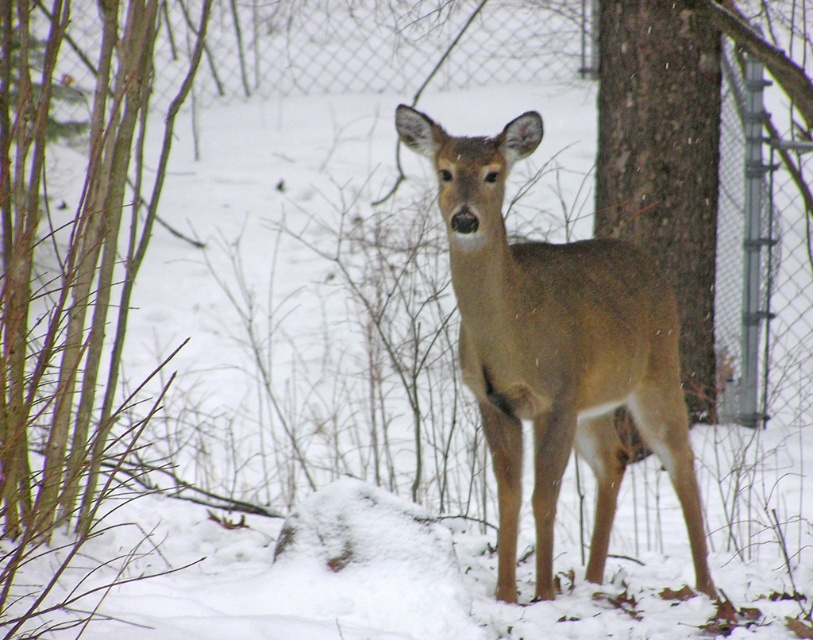
Question: Is brown matte/deer at center to the right of brown rough bark tree at center from the viewer's perspective?

Choices:
 (A) no
 (B) yes

Answer: (A)

Question: Among these points, which one is farthest from the camera?

Choices:
 (A) (555, 273)
 (B) (602, 173)

Answer: (B)

Question: Where is brown matte/deer at center located in relation to brown rough bark tree at center in the image?

Choices:
 (A) right
 (B) left

Answer: (B)

Question: Among these objects, which one is farthest from the camera?

Choices:
 (A) brown rough bark tree at center
 (B) brown matte/deer at center

Answer: (A)

Question: Which point is closer to the camera?

Choices:
 (A) brown matte/deer at center
 (B) brown rough bark tree at center

Answer: (A)

Question: Can you confirm if brown matte/deer at center is positioned to the left of brown rough bark tree at center?

Choices:
 (A) no
 (B) yes

Answer: (B)